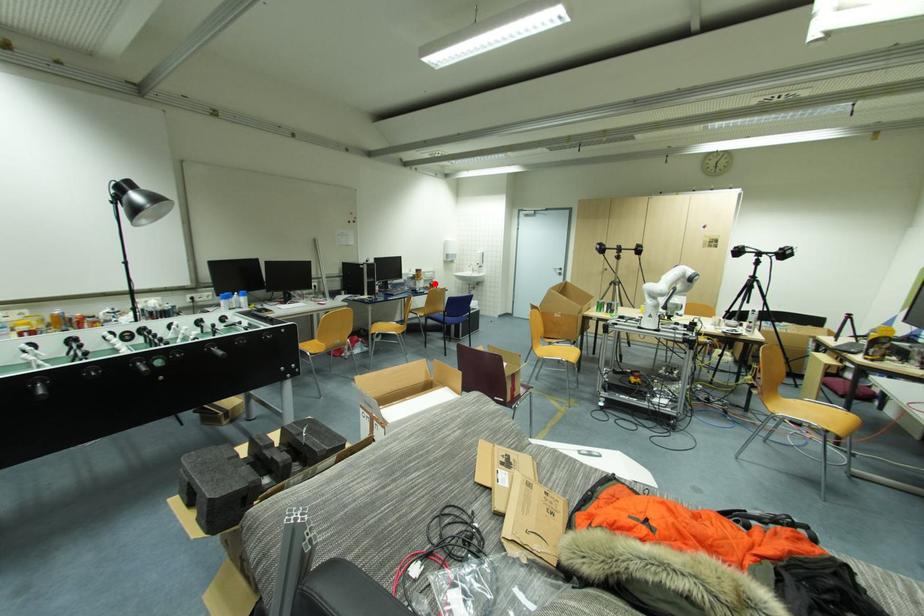
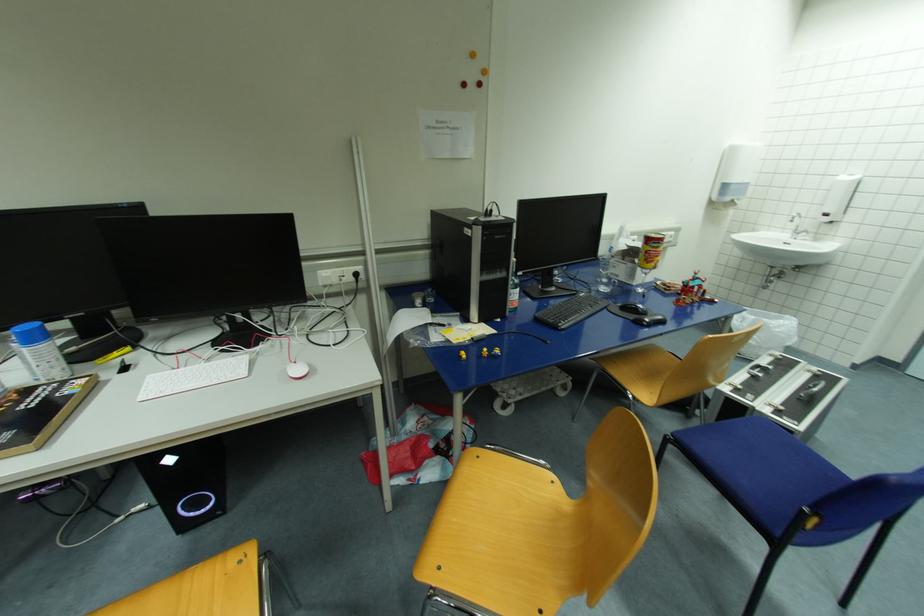
Find the pixel in the second image that matches the highlighted location in the first image.

(696, 285)